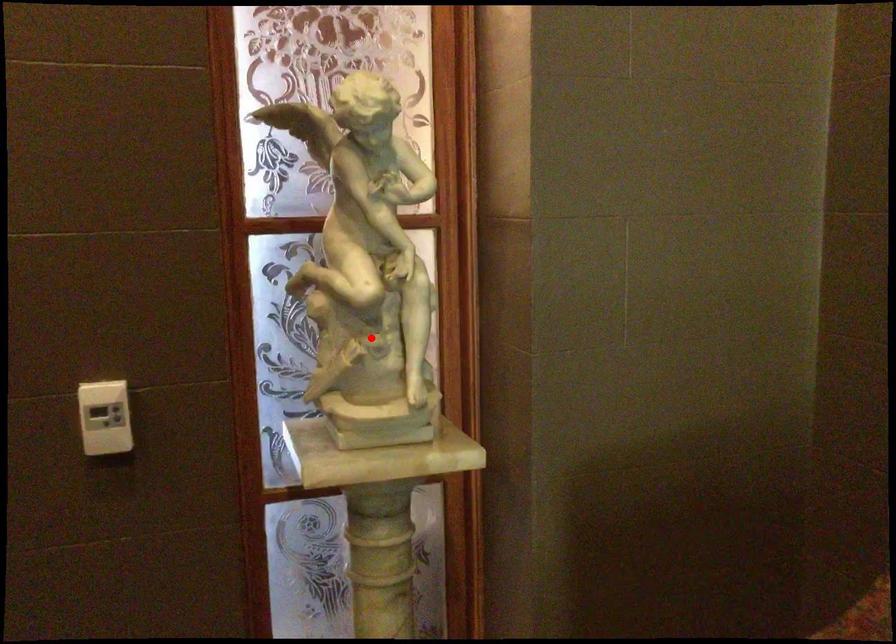
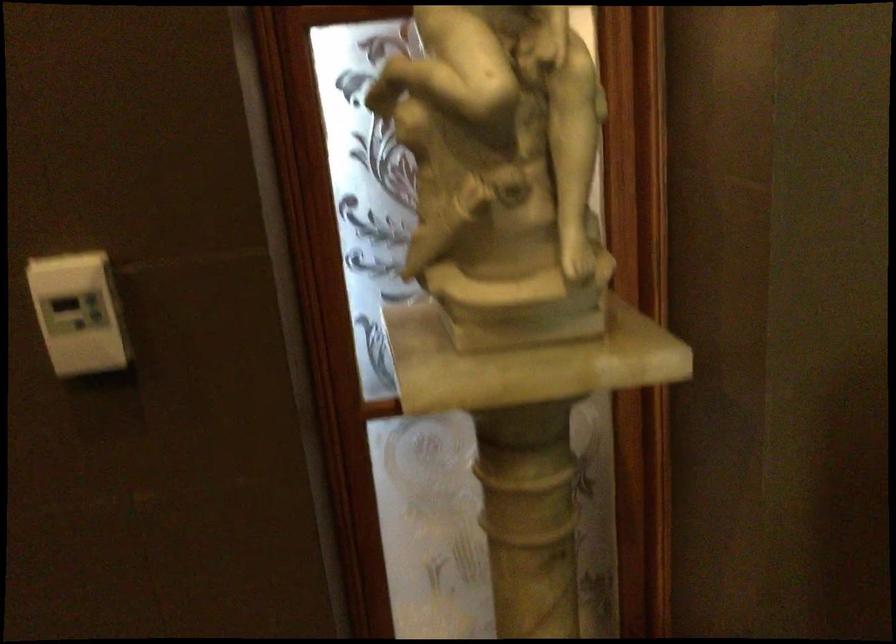
Find the pixel in the second image that matches the highlighted location in the first image.

(502, 172)